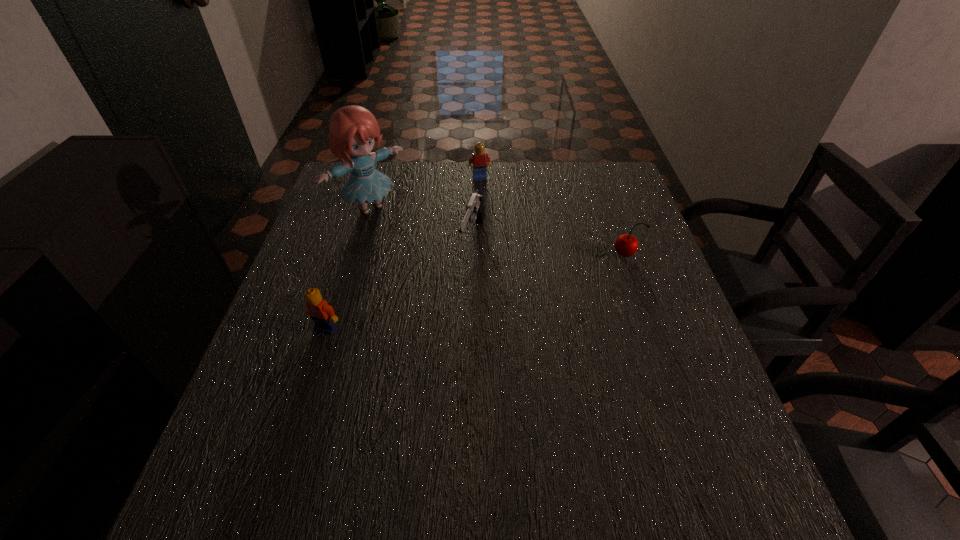
In the image, there is a desktop. In order to click on vacant space at the near right corner in this screenshot , I will do `click(693, 415)`.

Where is `free space between the nearest object and the farther Lego`? This screenshot has height=540, width=960. free space between the nearest object and the farther Lego is located at coordinates (403, 253).

Locate an element on the screen. This screenshot has height=540, width=960. vacant space that is in between the nearer Lego and the cherry is located at coordinates (475, 292).

You are a GUI agent. You are given a task and a screenshot of the screen. Output one action in this format:
    pyautogui.click(x=<x>, y=<y>)
    Task: Click on the unoccupied position between the tallest object and the left Lego
    
    Given the screenshot: What is the action you would take?
    pyautogui.click(x=348, y=268)

I want to click on free point between the rightmost object and the gun, so click(549, 247).

Image resolution: width=960 pixels, height=540 pixels. I want to click on free area in between the rightmost object and the tallest object, so click(497, 232).

Locate an element on the screen. Image resolution: width=960 pixels, height=540 pixels. vacant area that lies between the tallest object and the gun is located at coordinates (421, 223).

The height and width of the screenshot is (540, 960). Find the location of `free space between the nearer Lego and the farthest object`. free space between the nearer Lego and the farthest object is located at coordinates (403, 253).

Locate an element on the screen. The width and height of the screenshot is (960, 540). empty space that is in between the gun and the cherry is located at coordinates (549, 247).

What are the coordinates of `free space between the rightmost object and the nearest object` in the screenshot? It's located at (475, 292).